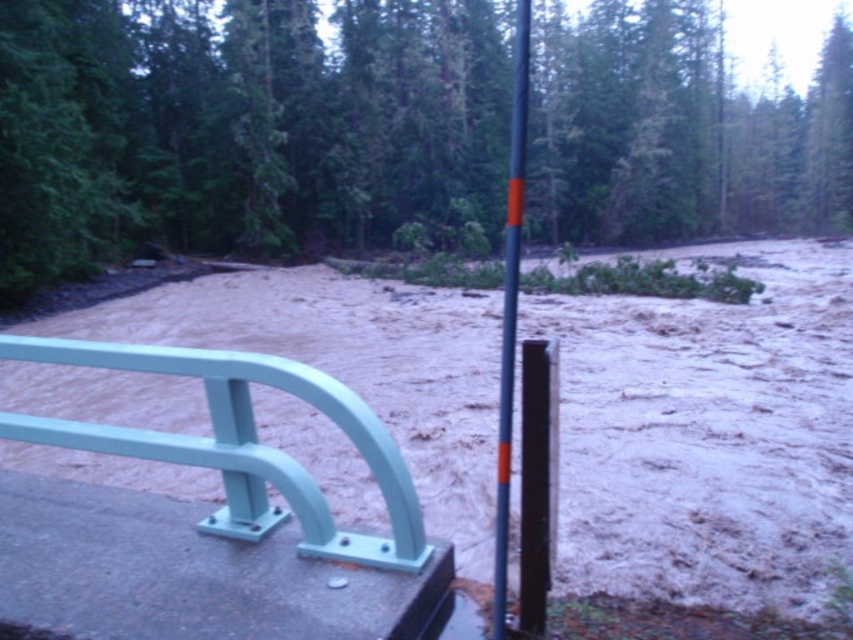
Question: Which object appears farthest from the camera in this image?

Choices:
 (A) brown sandy mud at center
 (B) green matte tree at upper center

Answer: (B)

Question: Can you confirm if matte green metal rail at left is thinner than orange-painted metal pole at center?

Choices:
 (A) no
 (B) yes

Answer: (B)

Question: Considering the real-world distances, which object is closest to the matte green metal rail at left?

Choices:
 (A) green matte tree at upper center
 (B) orange-painted metal pole at center
 (C) brown sandy mud at center

Answer: (C)

Question: Does brown sandy mud at center appear on the right side of orange-painted metal pole at center?

Choices:
 (A) no
 (B) yes

Answer: (A)

Question: Does green matte tree at upper center appear on the right side of matte green metal rail at left?

Choices:
 (A) no
 (B) yes

Answer: (B)

Question: Which point is farther to the camera?

Choices:
 (A) (494, 605)
 (B) (302, 422)
 (C) (491, 92)

Answer: (C)